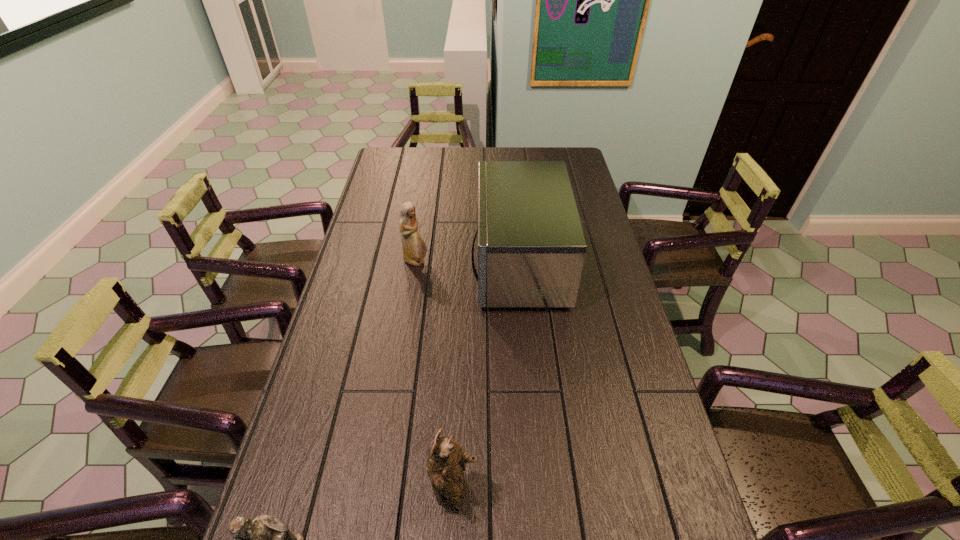
This screenshot has width=960, height=540. Identify the location of microwave oven. (531, 245).

This screenshot has height=540, width=960. I want to click on the second nearest object, so click(x=446, y=462).

The image size is (960, 540). What are the coordinates of `the rightmost figurine` in the screenshot? It's located at (446, 462).

This screenshot has width=960, height=540. Find the location of `the second figurine from left to right`. the second figurine from left to right is located at coordinates (414, 249).

I want to click on the third object from right to left, so click(x=414, y=249).

Locate an element on the screen. vacant region located on the front-facing side of the microwave oven is located at coordinates (380, 263).

Where is `free point located on the front-facing side of the microwave oven`? The image size is (960, 540). free point located on the front-facing side of the microwave oven is located at coordinates (429, 263).

Find the location of a particular element. The height and width of the screenshot is (540, 960). free space located on the front-facing side of the microwave oven is located at coordinates (426, 263).

In order to click on free point located on the front-facing side of the rightmost figurine in this screenshot , I will do `click(545, 494)`.

The width and height of the screenshot is (960, 540). In order to click on vacant area located on the front-facing side of the third object from right to left in this screenshot , I will do `click(492, 262)`.